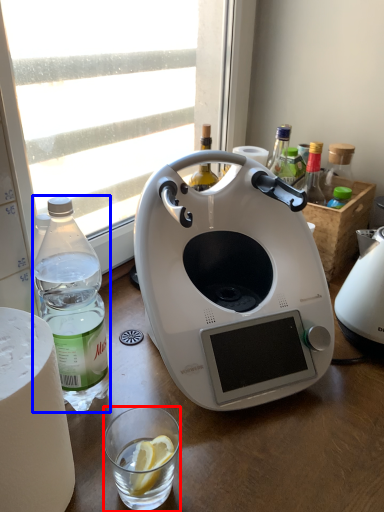
Question: Among these objects, which one is nearest to the camera, coffee cup (highlighted by a red box) or bottle (highlighted by a blue box)?

Choices:
 (A) coffee cup
 (B) bottle

Answer: (B)